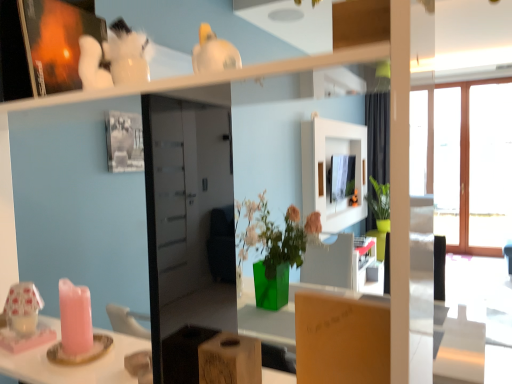
Question: Is wooden frame at right located outside matte brown cardboard box at center, the first cardboard box from the right?

Choices:
 (A) no
 (B) yes

Answer: (B)

Question: Can you confirm if wooden frame at right is taller than matte brown cardboard box at center, the second cardboard box viewed from the left?

Choices:
 (A) yes
 (B) no

Answer: (A)

Question: From the image's perspective, is wooden frame at right beneath matte brown cardboard box at center, the first cardboard box from the right?

Choices:
 (A) no
 (B) yes

Answer: (A)

Question: From the image's perspective, is wooden frame at right over matte brown cardboard box at center, the second cardboard box viewed from the left?

Choices:
 (A) yes
 (B) no

Answer: (A)

Question: Does wooden frame at right have a lesser width compared to matte brown cardboard box at center, the first cardboard box from the right?

Choices:
 (A) no
 (B) yes

Answer: (A)

Question: Is wooden frame at right taller or shorter than matte brown cardboard box at center, the first cardboard box from the right?

Choices:
 (A) tall
 (B) short

Answer: (A)

Question: From a real-world perspective, is wooden frame at right positioned above or below matte brown cardboard box at center, the second cardboard box viewed from the left?

Choices:
 (A) below
 (B) above

Answer: (B)

Question: Is wooden frame at right wider or thinner than matte brown cardboard box at center, the first cardboard box from the right?

Choices:
 (A) thin
 (B) wide

Answer: (B)

Question: Relative to matte brown cardboard box at center, the second cardboard box viewed from the left, is wooden frame at right in front or behind?

Choices:
 (A) front
 (B) behind

Answer: (B)

Question: From the image's perspective, is wooden block at center, which is the second cardboard box in right-to-left order, above or below wooden frame at right?

Choices:
 (A) below
 (B) above

Answer: (A)

Question: From a real-world perspective, is wooden block at center, which is the second cardboard box in right-to-left order, above or below wooden frame at right?

Choices:
 (A) above
 (B) below

Answer: (B)

Question: Considering the relative positions of wooden block at center, the first cardboard box from the left, and wooden frame at right in the image provided, is wooden block at center, the first cardboard box from the left, to the left or to the right of wooden frame at right?

Choices:
 (A) right
 (B) left

Answer: (B)

Question: Is wooden block at center, the first cardboard box from the left, in front of or behind wooden frame at right in the image?

Choices:
 (A) behind
 (B) front

Answer: (B)

Question: Considering the positions of point (298, 380) and point (506, 127), is point (298, 380) closer or farther from the camera than point (506, 127)?

Choices:
 (A) farther
 (B) closer

Answer: (B)

Question: Looking at their shapes, would you say matte brown cardboard box at center, the first cardboard box from the right, is wider or thinner than wooden frame at right?

Choices:
 (A) thin
 (B) wide

Answer: (A)